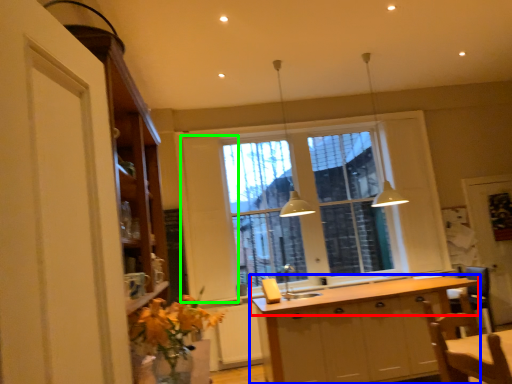
Question: Estimate the real-world distances between objects in this image. Which object is closer to countertop (highlighted by a red box), cabinetry (highlighted by a blue box) or screen door (highlighted by a green box)?

Choices:
 (A) cabinetry
 (B) screen door

Answer: (A)